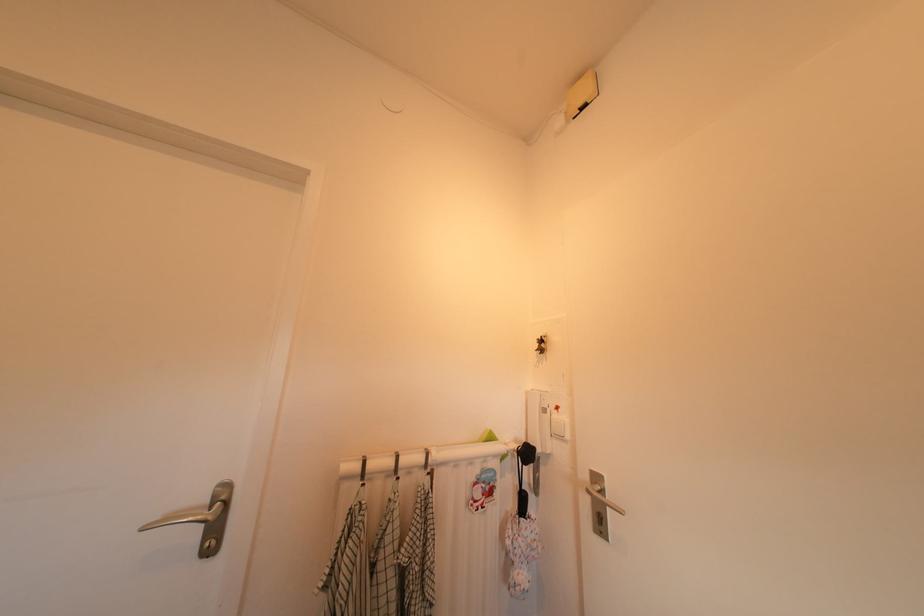
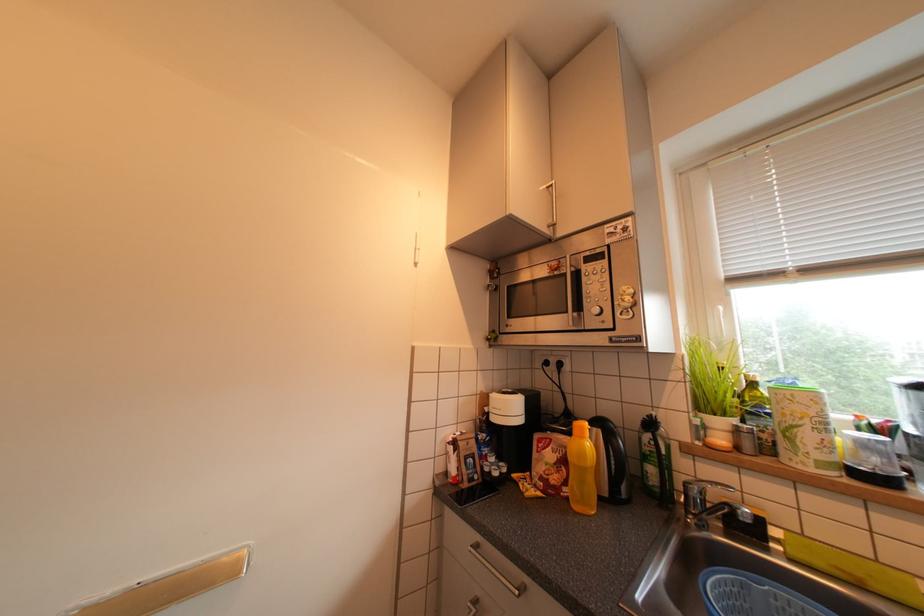
Question: Based on the continuous images, in which direction is the camera rotating? Reply with the corresponding letter.

Choices:
 (A) Left
 (B) Right
 (C) Up
 (D) Down

Answer: (B)